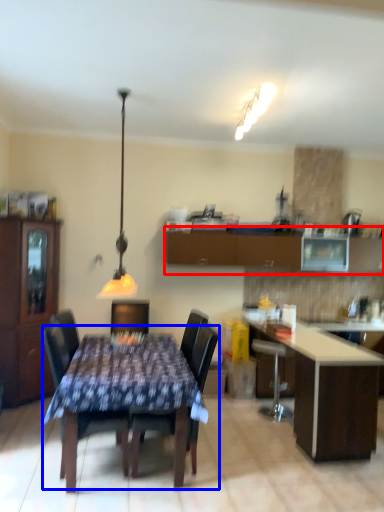
Question: Which of the following is the closest to the observer, cabinetry (highlighted by a red box) or kitchen & dining room table (highlighted by a blue box)?

Choices:
 (A) cabinetry
 (B) kitchen & dining room table

Answer: (B)